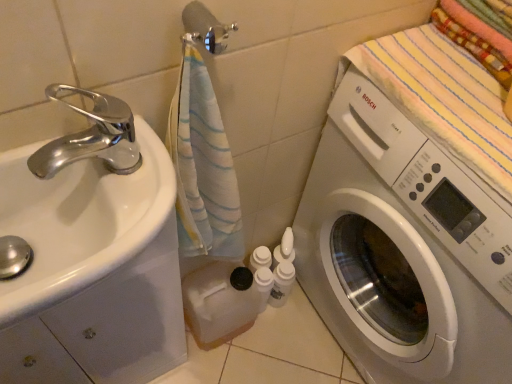
Question: Do you think white glossy sink at left is within white glossy washing machine at right, or outside of it?

Choices:
 (A) inside
 (B) outside

Answer: (B)

Question: From the image's perspective, is white glossy sink at left located above or below white glossy washing machine at right?

Choices:
 (A) below
 (B) above

Answer: (B)

Question: Considering the real-world distances, which object is closest to the silver metallic towel bar at upper center?

Choices:
 (A) white glossy sink at left
 (B) striped cotton beach towel at upper right
 (C) white glossy washing machine at right

Answer: (A)

Question: Which of these objects is positioned closest to the white glossy washing machine at right?

Choices:
 (A) silver metallic towel bar at upper center
 (B) white glossy sink at left
 (C) striped cotton beach towel at upper right

Answer: (C)